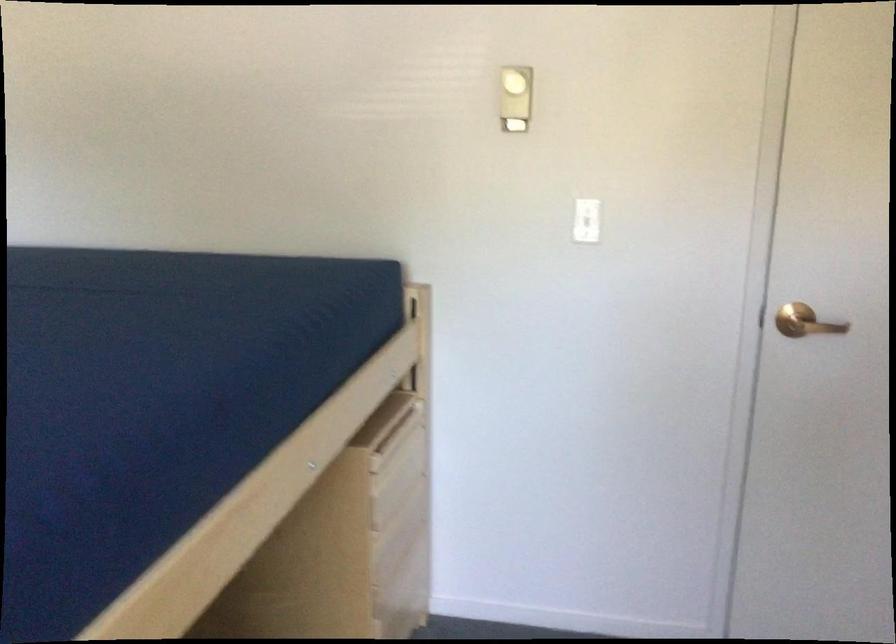
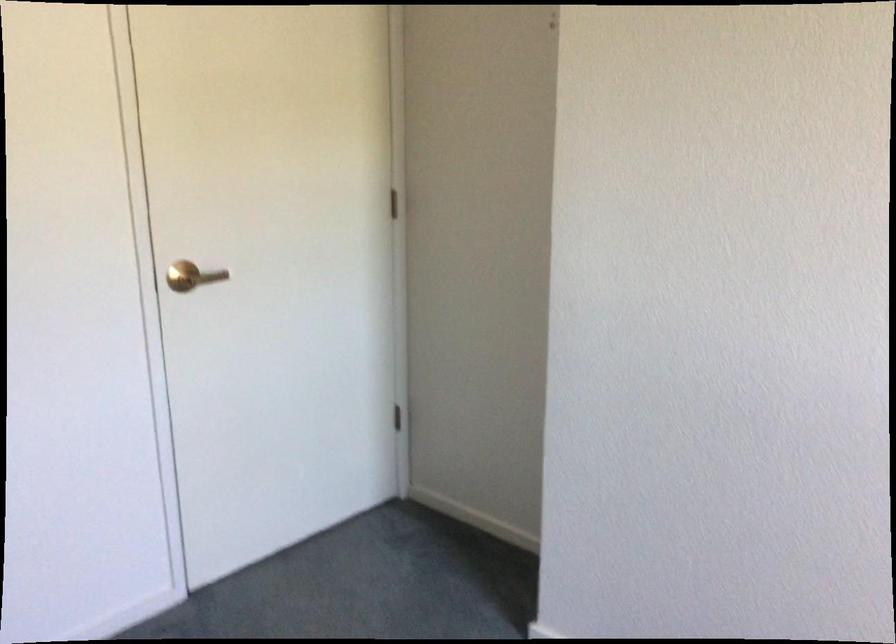
Question: How did the camera likely rotate?

Choices:
 (A) Left
 (B) Right
 (C) Up
 (D) Down

Answer: (B)